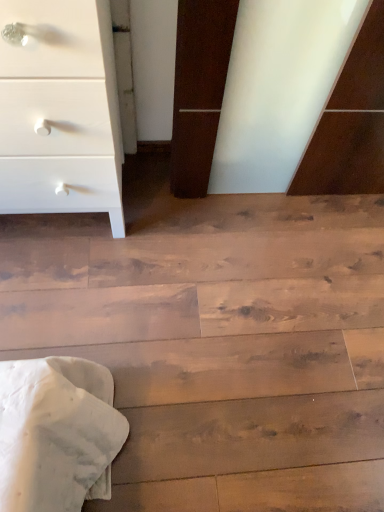
Question: Which is correct: wooden floor at lower center is inside white matte chest of drawers at upper left, or outside of it?

Choices:
 (A) outside
 (B) inside

Answer: (A)

Question: Considering the positions of wooden floor at lower center and white matte chest of drawers at upper left in the image, is wooden floor at lower center taller or shorter than white matte chest of drawers at upper left?

Choices:
 (A) short
 (B) tall

Answer: (A)

Question: From the image's perspective, is wooden floor at lower center above or below white matte chest of drawers at upper left?

Choices:
 (A) below
 (B) above

Answer: (A)

Question: Relative to wooden floor at lower center, is white matte chest of drawers at upper left in front or behind?

Choices:
 (A) front
 (B) behind

Answer: (A)

Question: Based on their positions, is white matte chest of drawers at upper left located to the left or right of wooden floor at lower center?

Choices:
 (A) left
 (B) right

Answer: (A)

Question: Considering the positions of white matte chest of drawers at upper left and wooden floor at lower center in the image, is white matte chest of drawers at upper left bigger or smaller than wooden floor at lower center?

Choices:
 (A) small
 (B) big

Answer: (B)

Question: From the image's perspective, is white matte chest of drawers at upper left positioned above or below wooden floor at lower center?

Choices:
 (A) above
 (B) below

Answer: (A)